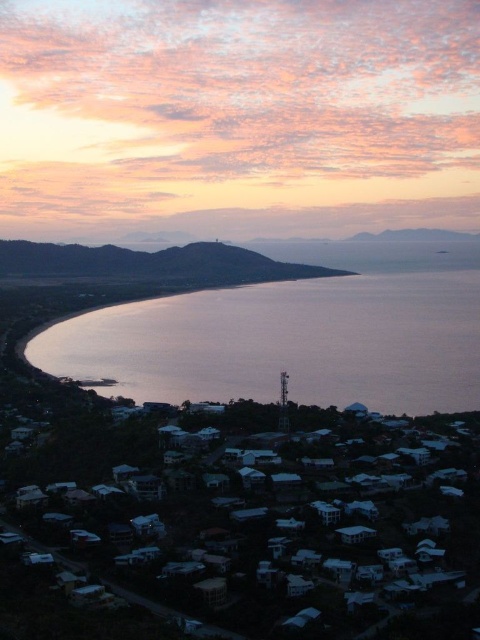
Question: Which of the following is the farthest from the observer?

Choices:
 (A) silvery reflective water at center
 (B) pink cloud at upper center
 (C) matte brown hillside at center

Answer: (B)

Question: Is pink cloud at upper center bigger than silvery reflective water at center?

Choices:
 (A) yes
 (B) no

Answer: (A)

Question: Estimate the real-world distances between objects in this image. Which object is closer to the silvery reflective water at center?

Choices:
 (A) matte brown hillside at center
 (B) pink cloud at upper center

Answer: (A)

Question: Can you confirm if pink cloud at upper center is positioned to the left of silvery reflective water at center?

Choices:
 (A) no
 (B) yes

Answer: (B)

Question: Is pink cloud at upper center to the right of matte brown hillside at center from the viewer's perspective?

Choices:
 (A) yes
 (B) no

Answer: (A)

Question: Which object is positioned closest to the silvery reflective water at center?

Choices:
 (A) pink cloud at upper center
 (B) matte brown hillside at center

Answer: (B)